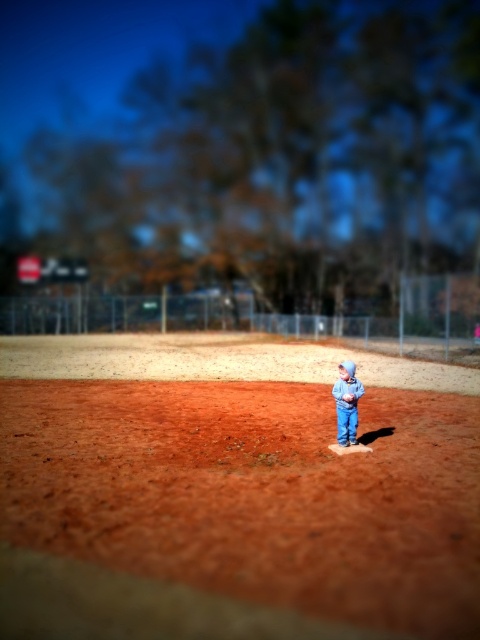
Question: Which point appears closest to the camera in this image?

Choices:
 (A) (359, 385)
 (B) (360, 480)

Answer: (B)

Question: Which object is closer to the camera taking this photo?

Choices:
 (A) blue denim pants at center
 (B) brown dirt field at center

Answer: (B)

Question: Does brown dirt field at center appear on the right side of blue denim pants at center?

Choices:
 (A) no
 (B) yes

Answer: (A)

Question: Is brown dirt field at center to the left of blue denim pants at center from the viewer's perspective?

Choices:
 (A) no
 (B) yes

Answer: (B)

Question: Can you confirm if brown dirt field at center is wider than blue denim pants at center?

Choices:
 (A) no
 (B) yes

Answer: (B)